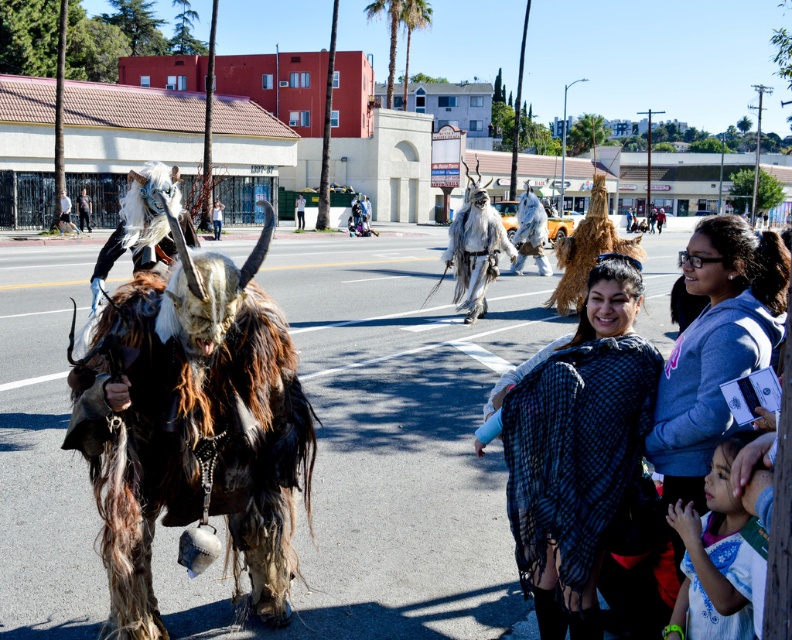
Question: Which is farther from the smooth leather glove at center?

Choices:
 (A) white fur costume at lower right
 (B) white fur costume at center
 (C) white cotton shirt at center

Answer: (A)

Question: Does black textured shawl at center have a lesser width compared to white fur mask at left?

Choices:
 (A) no
 (B) yes

Answer: (B)

Question: Which of the following is the closest to the observer?

Choices:
 (A) smooth leather glove at center
 (B) black textured shawl at center

Answer: (B)

Question: Can you confirm if white cotton shirt at center is positioned below white fur costume at center?

Choices:
 (A) no
 (B) yes

Answer: (B)

Question: Which is nearer to the smooth leather glove at center?

Choices:
 (A) white cotton shirt at center
 (B) white fur costume at center
 (C) black textured shawl at center

Answer: (A)

Question: Does smooth leather glove at center appear under white fur costume at center?

Choices:
 (A) yes
 (B) no

Answer: (A)